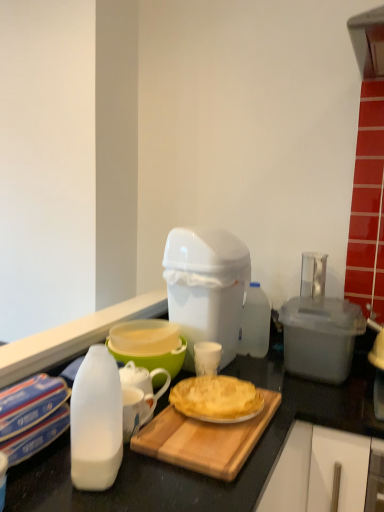
Question: From a real-world perspective, is transparent plastic container at right, placed as the 2th appliance when sorted from left to right, positioned above or below green plastic bowl at center?

Choices:
 (A) below
 (B) above

Answer: (B)

Question: Is point (334, 316) positioned closer to the camera than point (147, 366)?

Choices:
 (A) farther
 (B) closer

Answer: (A)

Question: Which object is positioned closest to the translucent plastic bottle at center-right?

Choices:
 (A) transparent plastic container at right, placed as the 2th appliance when sorted from left to right
 (B) golden flaky pie at center
 (C) wooden cutting board at center
 (D) white plastic trash can at center, marked as the second appliance in a right-to-left arrangement
 (E) green plastic bowl at center

Answer: (D)

Question: Estimate the real-world distances between objects in this image. Which object is closer to the transparent plastic container at right, placed as the 2th appliance when sorted from left to right?

Choices:
 (A) wooden cutting board at center
 (B) translucent plastic bottle at center-right
 (C) green plastic bowl at center
 (D) golden flaky pie at center
 (E) white plastic trash can at center, the first appliance when ordered from left to right

Answer: (B)